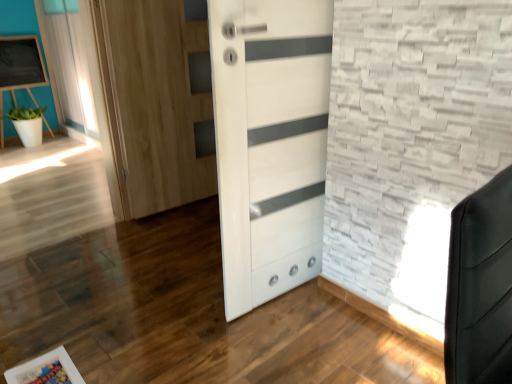
Find the location of `vacant point above wooden picture frame at lower left (from a real-world perspective)`. vacant point above wooden picture frame at lower left (from a real-world perspective) is located at coordinates 44,370.